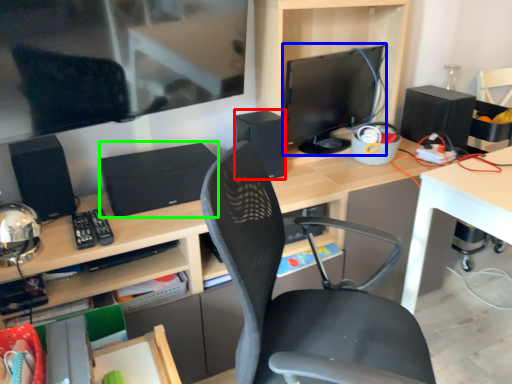
Question: Based on their relative distances, which object is nearer to speaker (highlighted by a red box)? Choose from computer monitor (highlighted by a blue box) and computer (highlighted by a green box).

Choices:
 (A) computer monitor
 (B) computer

Answer: (A)